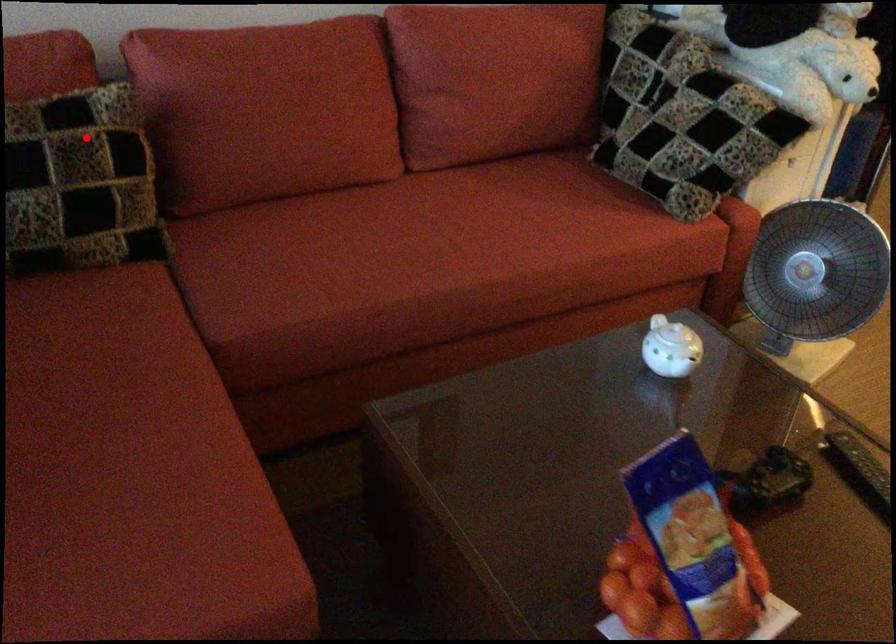
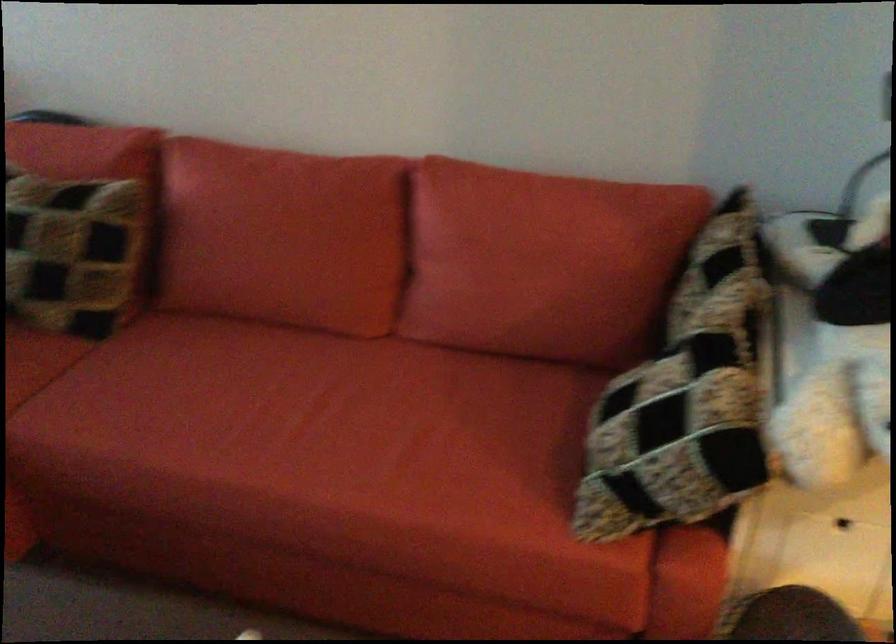
Where in the second image is the point corresponding to the highlighted location from the first image?

(76, 223)